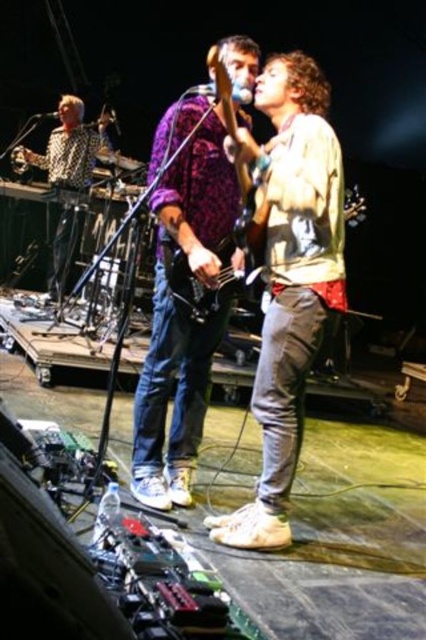
Question: Does purple textured shirt at center come in front of brushed metal keyboard at left?

Choices:
 (A) yes
 (B) no

Answer: (A)

Question: Considering the real-world distances, which object is farthest from the brushed metal keyboard at left?

Choices:
 (A) metallic silver microphone at upper center
 (B) purple textured shirt at center
 (C) shiny purple guitar at center

Answer: (C)

Question: Which object appears closest to the camera in this image?

Choices:
 (A) brushed metal keyboard at left
 (B) white leather jacket at center

Answer: (B)

Question: Is the position of white leather jacket at center more distant than that of brushed metal keyboard at left?

Choices:
 (A) no
 (B) yes

Answer: (A)

Question: Does brushed metal keyboard at left appear on the left side of shiny purple guitar at center?

Choices:
 (A) yes
 (B) no

Answer: (A)

Question: Which object appears farthest from the camera in this image?

Choices:
 (A) brushed metal keyboard at left
 (B) metallic silver microphone at center

Answer: (A)